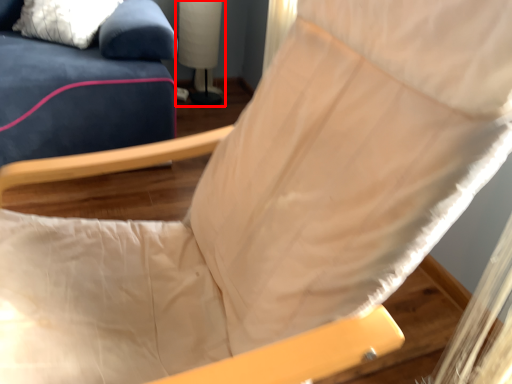
Question: From the image's perspective, considering the relative positions of table lamp (annotated by the red box) and pillow in the image provided, where is table lamp (annotated by the red box) located with respect to the staircase?

Choices:
 (A) below
 (B) above

Answer: (B)